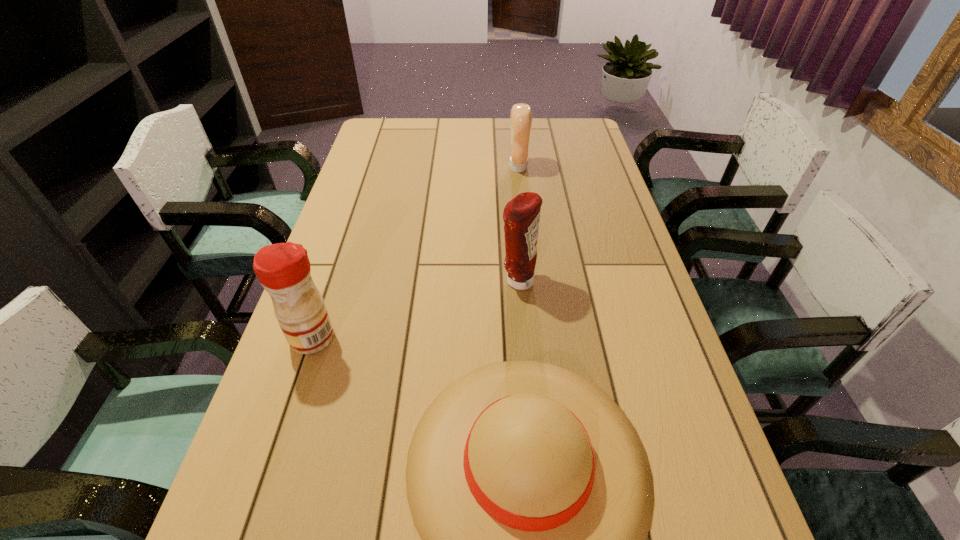
At what (x,y) coordinates should I click in order to perform the action: click on free point between the leftmost condiment and the second shortest object. Please return your answer as a coordinate pair (x, y). The image size is (960, 540). Looking at the image, I should click on (416, 253).

Identify which object is located as the third nearest to the shortest object. Please provide its 2D coordinates. Your answer should be formatted as a tuple, i.e. [(x, y)], where the tuple contains the x and y coordinates of a point satisfying the conditions above.

[(521, 114)]

This screenshot has width=960, height=540. Identify the location of object that is the closest to the farthest condiment. (521, 215).

Locate which condiment is the second closest to the second farthest object. Please provide its 2D coordinates. Your answer should be formatted as a tuple, i.e. [(x, y)], where the tuple contains the x and y coordinates of a point satisfying the conditions above.

[(521, 114)]

Select which condiment is the second closest to the farthest condiment. Please provide its 2D coordinates. Your answer should be formatted as a tuple, i.e. [(x, y)], where the tuple contains the x and y coordinates of a point satisfying the conditions above.

[(283, 269)]

Where is `free space that satisfies the following two spatial constraints: 1. on the label of the farthest object; 2. on the front side of the second farthest condiment`? free space that satisfies the following two spatial constraints: 1. on the label of the farthest object; 2. on the front side of the second farthest condiment is located at coordinates (531, 281).